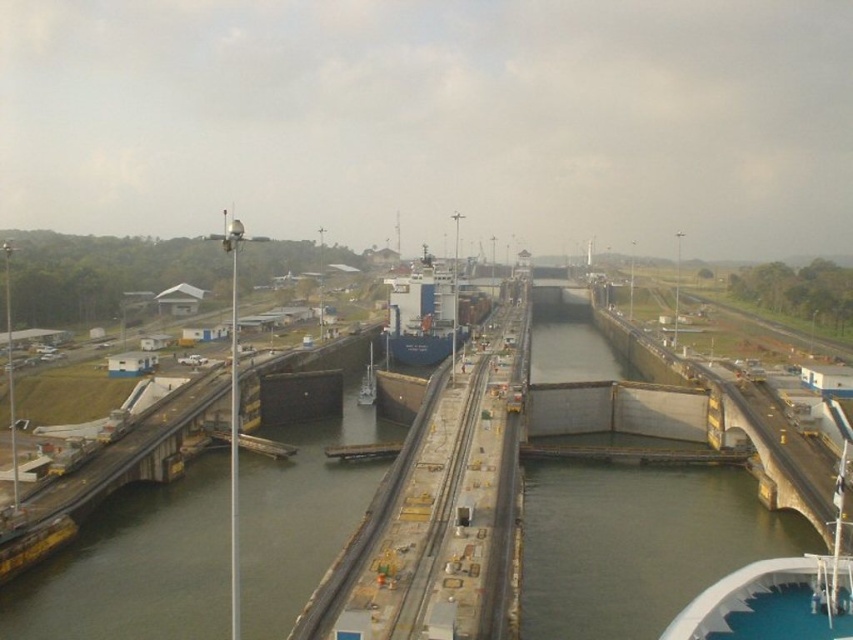
You are standing at the edge of the canal lock system and want to reach a specific point marked at coordinates point (610, 577). If your maximum comfortable walking distance is 50 meters, can you comfortably walk to that point from your current position?

The distance of point (610, 577) from viewer is 57.59 meters, which exceeds your maximum comfortable walking distance of 50 meters. Therefore, you cannot comfortably walk to that point from your current position.

You are an engineer observing the canal lock system. You notice two ships, the blue matte container ship at center and the blue matte ship at center. Which ship is positioned higher in the lock chamber?

The blue matte container ship at center is positioned higher in the lock chamber than the blue matte ship at center.

You are a navigation officer guiding a ship through the Panama Canal. The blue matte container ship at center is positioned in the lock chamber. Based on its coordinates, is the ship centered within the lock chamber?

The blue matte container ship at center is located at point coordinates approximately 0.494 on the x and 0.497 on the y axis, which are very close to the center coordinates of the lock chamber. Therefore, the ship is centered within the lock chamber.